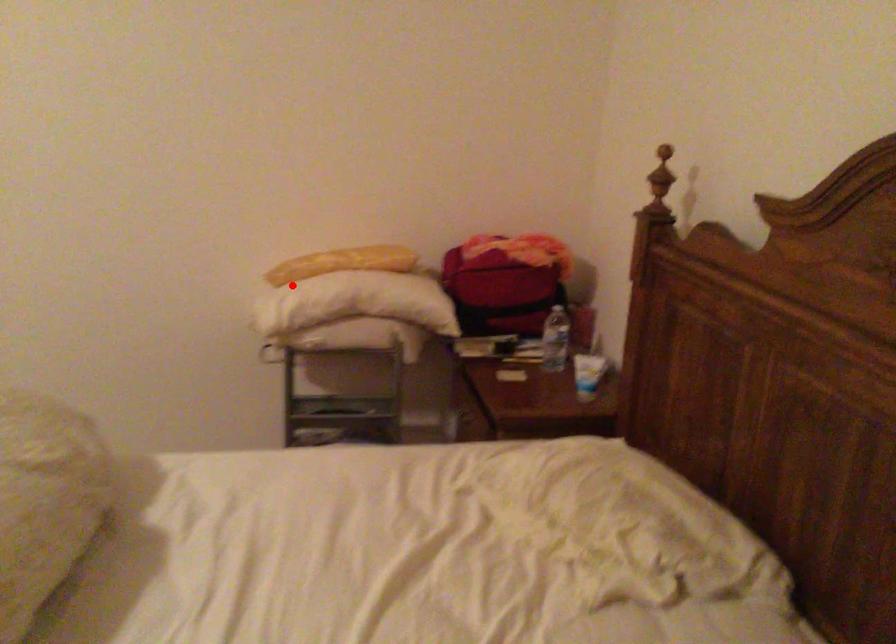
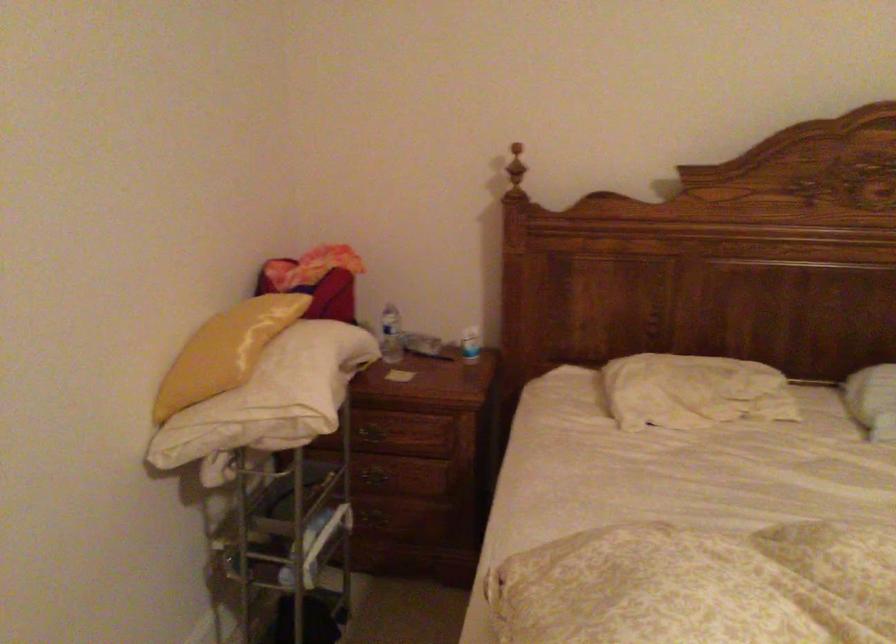
Question: A red point is marked in image1. In image2, is the corresponding 3D point closer to the camera or farther? Reply with the corresponding letter.

Choices:
 (A) The corresponding 3D point is closer.
 (B) The corresponding 3D point is farther.

Answer: (A)